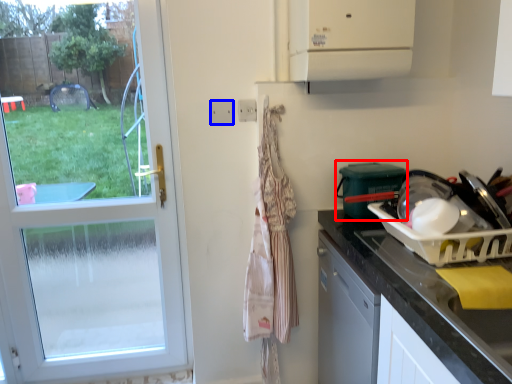
Question: Which object appears closest to the camera in this image, appliance (highlighted by a red box) or electric outlet (highlighted by a blue box)?

Choices:
 (A) appliance
 (B) electric outlet

Answer: (A)